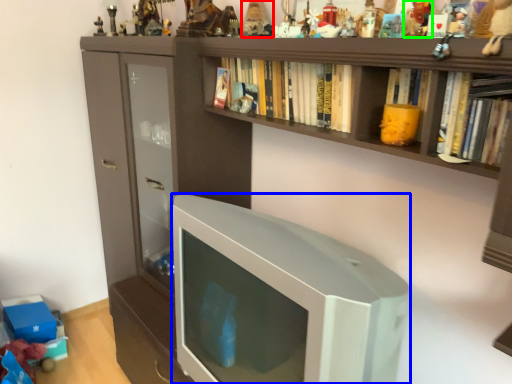
Question: Based on their relative distances, which object is farther from toy (highlighted by a red box)? Choose from television (highlighted by a blue box) and toy (highlighted by a green box).

Choices:
 (A) television
 (B) toy

Answer: (A)